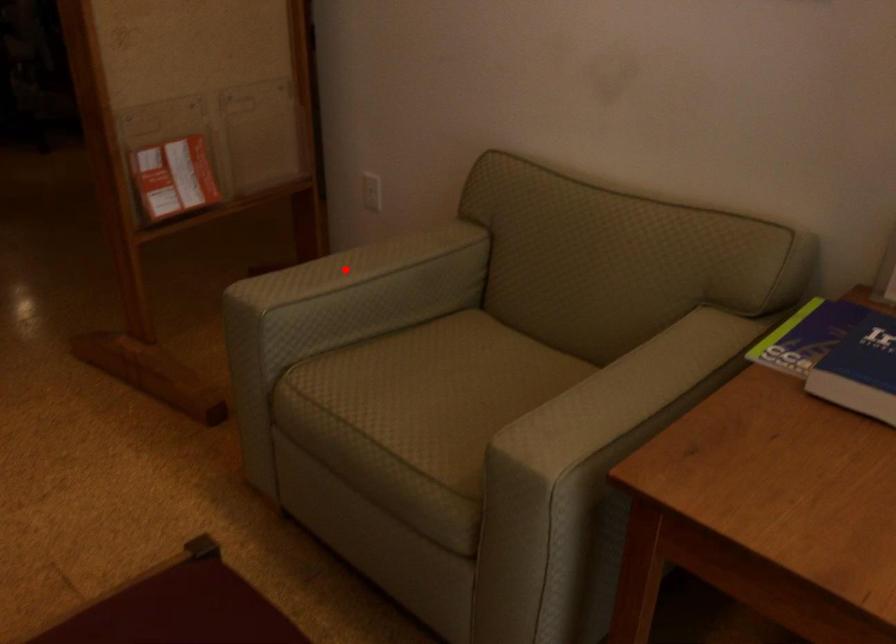
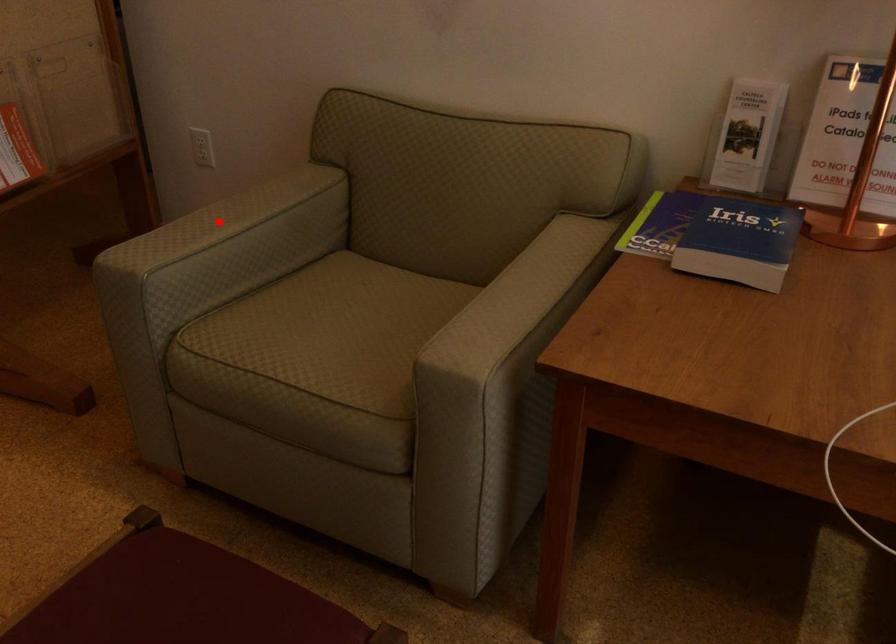
I am providing you with two images of the same scene from different viewpoints. A red point is marked on the first image and another point is marked on the second image. Is the marked point in image1 the same physical position as the marked point in image2?

Yes